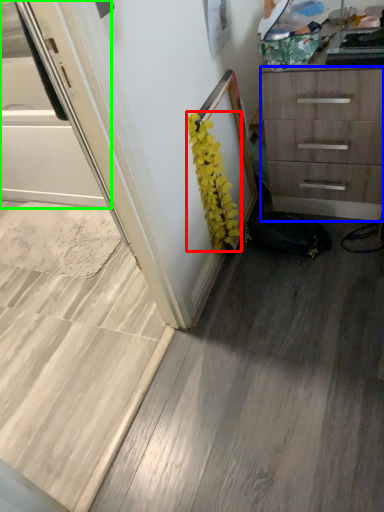
Question: Which object is positioned closest to flower (highlighted by a red box)? Select from chest of drawers (highlighted by a blue box) and screen door (highlighted by a green box).

Choices:
 (A) chest of drawers
 (B) screen door

Answer: (A)